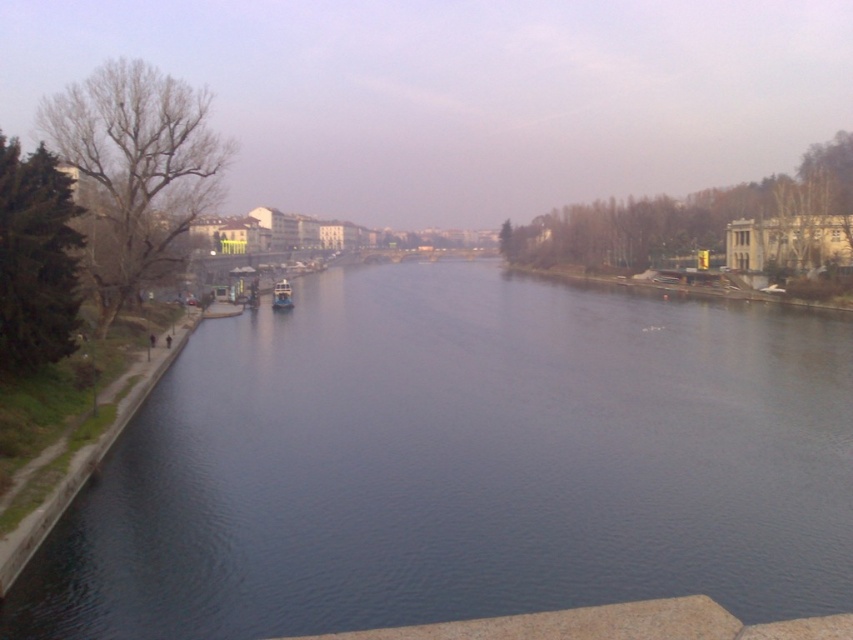
You are standing on the left side of the river and want to cross to the right side using the blue metallic boat at center. According to the scene description, which direction should you steer the boat to reach the dark blue water at center?

You should steer the boat to the right because the dark blue water at center is located to the right of the blue metallic boat at center.

You are planning to take a photo of the dark blue water at center and the blue metallic boat at center from the left side of the river. Which object will occupy more space in your photo?

The dark blue water at center occupies more space in the photo because it is bigger than the blue metallic boat at center.

Looking at this image, you are standing on the riverbank and want to take a photo of the dark blue water at center and the blue metallic boat at center. Which object will appear larger in your photo?

The dark blue water at center will appear larger in the photo because it is closer to the viewer than the blue metallic boat at center.